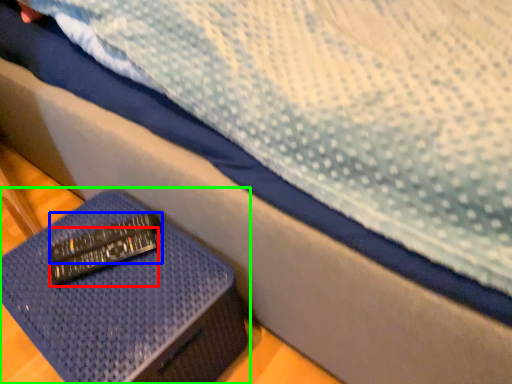
Question: Which object is positioned farthest from remote (highlighted by a red box)? Select from remote (highlighted by a blue box) and furniture (highlighted by a green box).

Choices:
 (A) remote
 (B) furniture

Answer: (B)